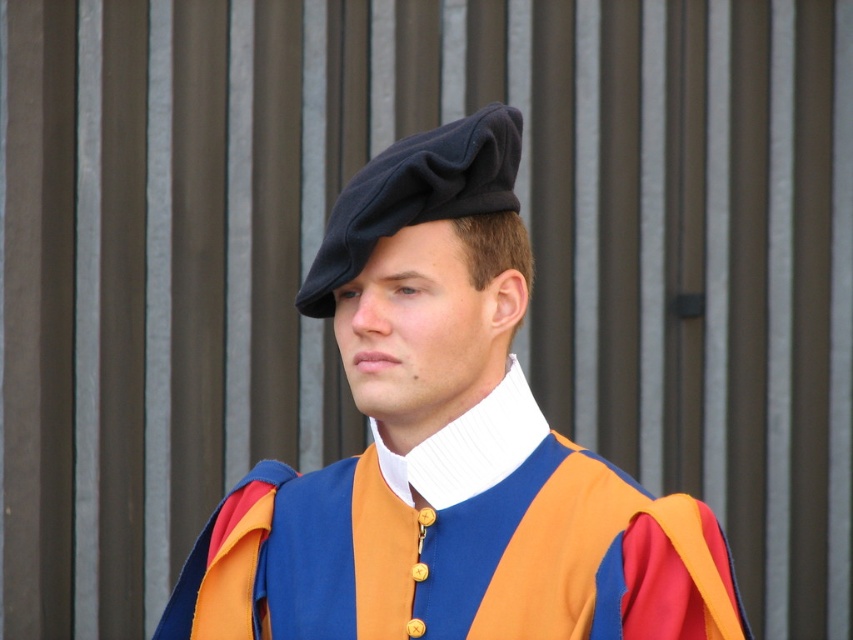
Who is more forward, [467,275] or [498,136]?

Point [467,275] is in front.

Can you confirm if matte black beret at center is wider than black felt beret at center?

Yes, matte black beret at center is wider than black felt beret at center.

Who is more distant from viewer, (x=485, y=163) or (x=445, y=179)?

Point (x=485, y=163)

Locate an element on the screen. This screenshot has width=853, height=640. matte black beret at center is located at coordinates (445, 449).